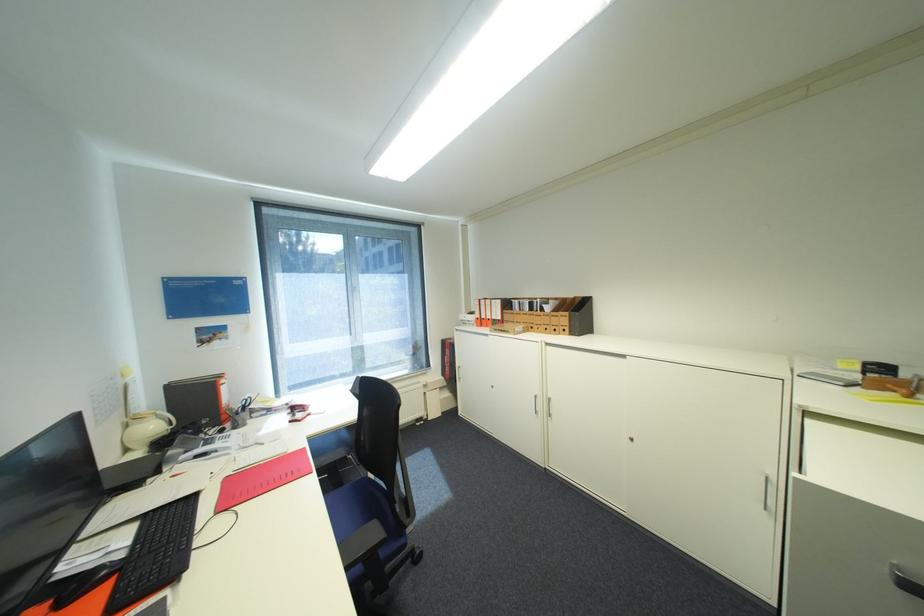
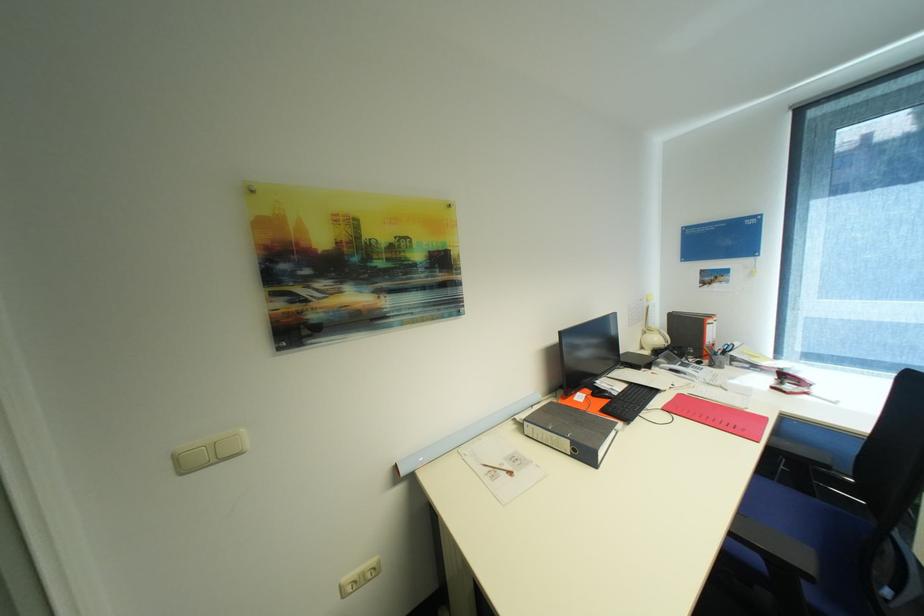
Find the pixel in the second image that matches (x=307, y=416) in the first image.

(796, 387)